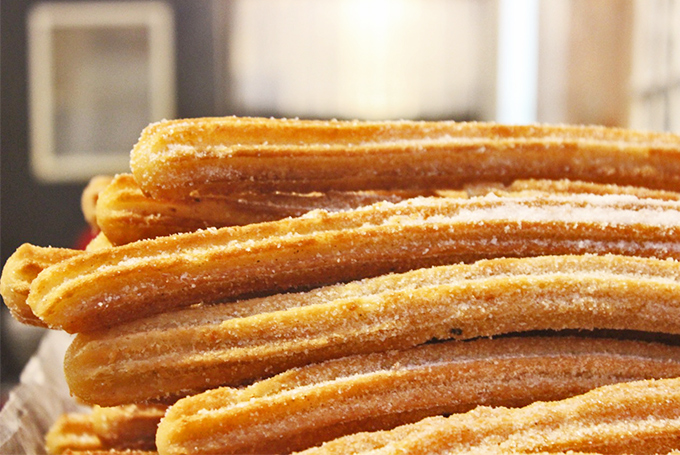
Locate an element on the screen. Image resolution: width=680 pixels, height=455 pixels. frame is located at coordinates (160, 34).